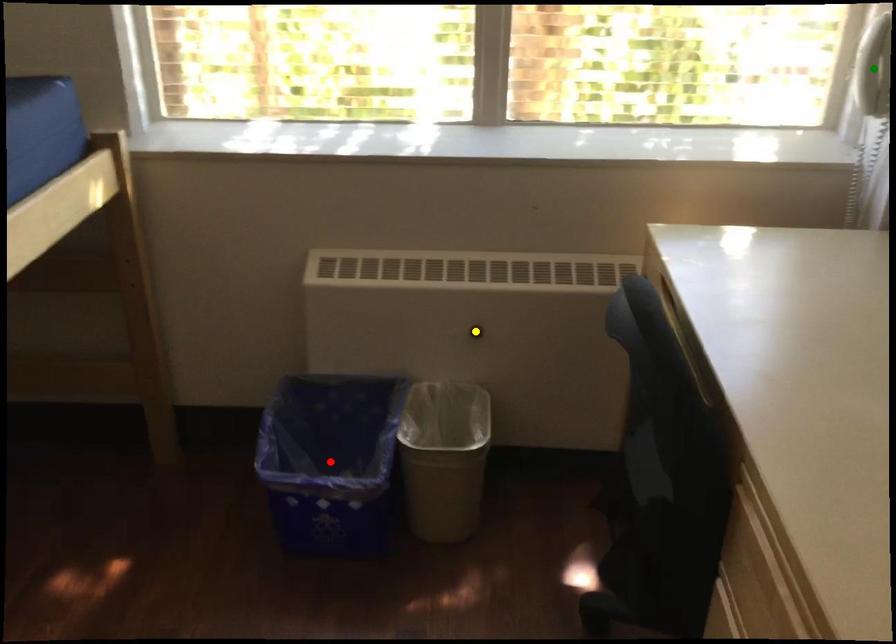
Order these from nearest to farthest:
- red point
- yellow point
- green point

green point
red point
yellow point